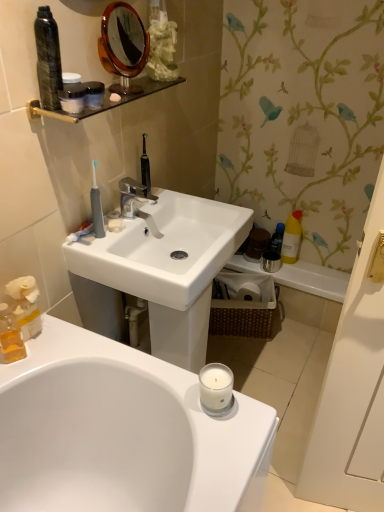
Question: From their relative heights in the image, would you say black glass shelf at upper center is taller or shorter than blue plastic bottle at right, which is counted as the 4th mouthwash, starting from the top?

Choices:
 (A) short
 (B) tall

Answer: (A)

Question: Is black glass shelf at upper center situated inside blue plastic bottle at right, placed as the first mouthwash when sorted from back to front, or outside?

Choices:
 (A) inside
 (B) outside

Answer: (B)

Question: Considering the real-world distances, which object is closest to the white ceramic faucet at center?

Choices:
 (A) black glass shelf at upper center
 (B) matte black container at upper left, arranged as the 4th mouthwash when viewed from the right
 (C) satin black container at upper left, acting as the fourth mouthwash starting from the back
 (D) yellow matte bottle at right, which is the fifth mouthwash in left-to-right order
 (E) gray rubber toothbrush at upper left

Answer: (E)

Question: Which object is positioned farthest from the blue plastic bottle at right, the fifth mouthwash positioned from the front?

Choices:
 (A) matte black container at upper left, which appears as the third mouthwash when viewed from the back
 (B) gray rubber toothbrush at upper left
 (C) yellow matte bottle at right, which is the third mouthwash from bottom to top
 (D) orange wooden mirror at upper center
 (E) white ceramic faucet at center

Answer: (A)